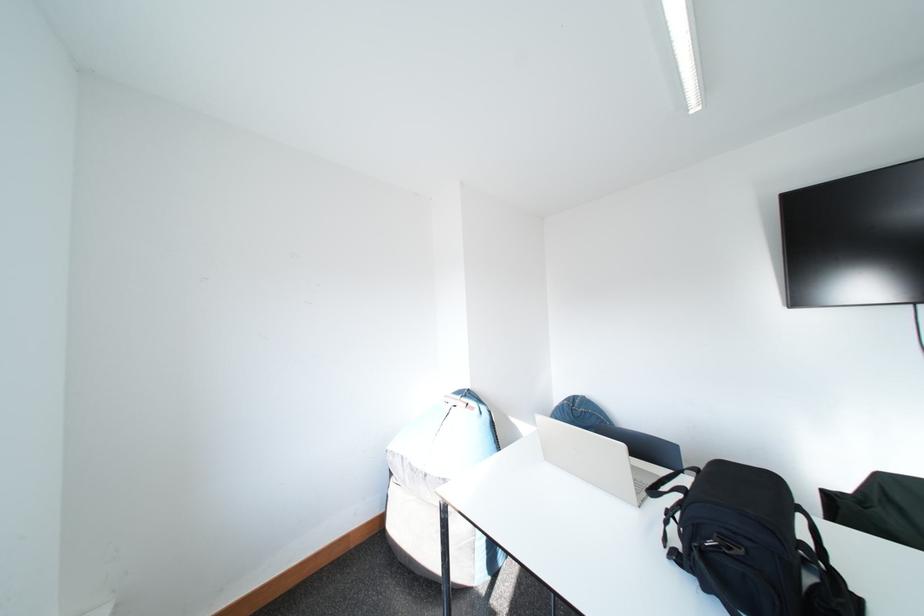
The image size is (924, 616). I want to click on backpack top handle, so click(670, 483).